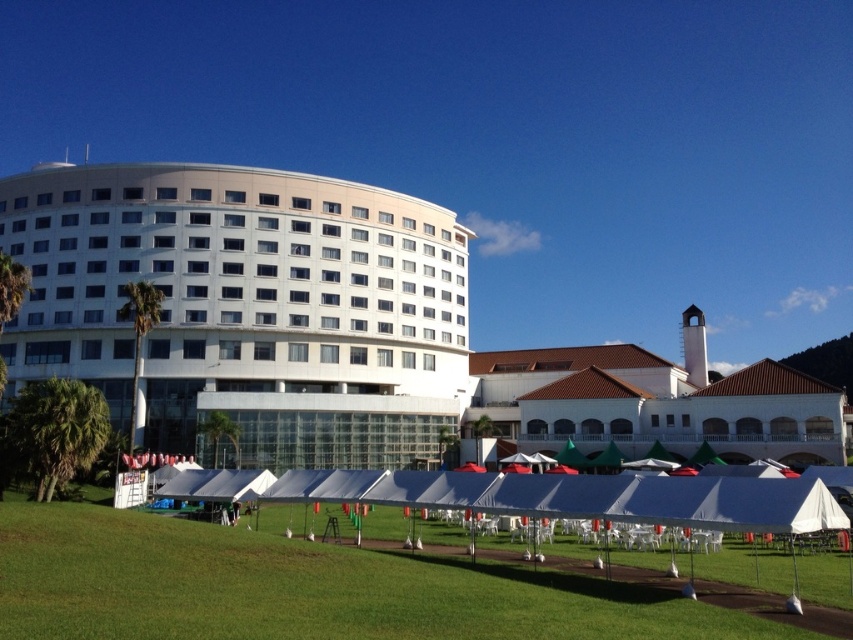
Question: Which point is closer to the camera taking this photo?

Choices:
 (A) (131, 348)
 (B) (592, 387)

Answer: (A)

Question: Does white smooth building at left appear on the right side of white matte building at center?

Choices:
 (A) no
 (B) yes

Answer: (A)

Question: Observing the image, what is the correct spatial positioning of white matte building at center in reference to white fabric tent at lower center?

Choices:
 (A) right
 (B) left

Answer: (A)

Question: Which object is closer to the camera taking this photo?

Choices:
 (A) white fabric tent at lower center
 (B) white matte building at center
 (C) white smooth building at left

Answer: (A)

Question: Is white matte building at center thinner than white fabric tent at lower center?

Choices:
 (A) yes
 (B) no

Answer: (A)

Question: Among these points, which one is nearest to the camera?

Choices:
 (A) (665, 436)
 (B) (410, 371)

Answer: (A)